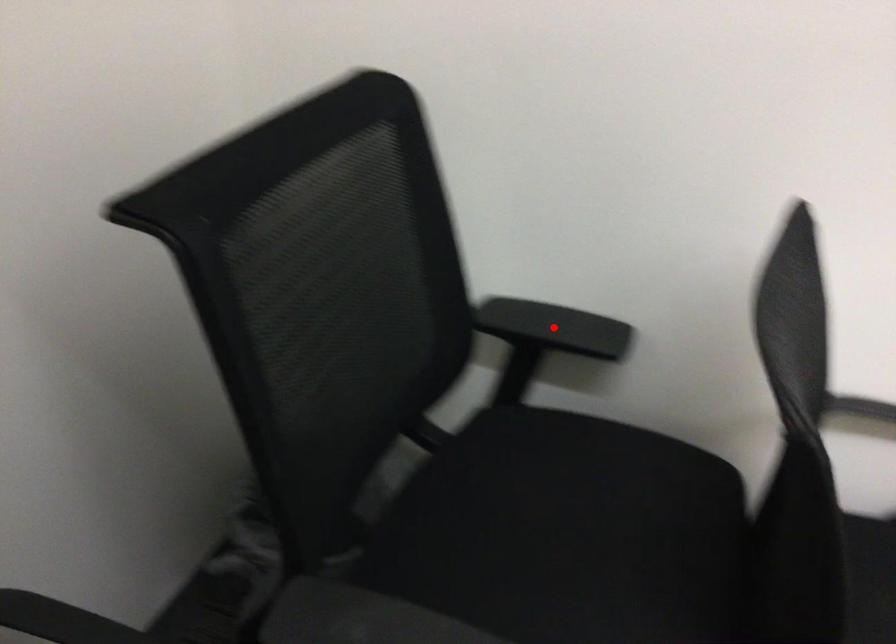
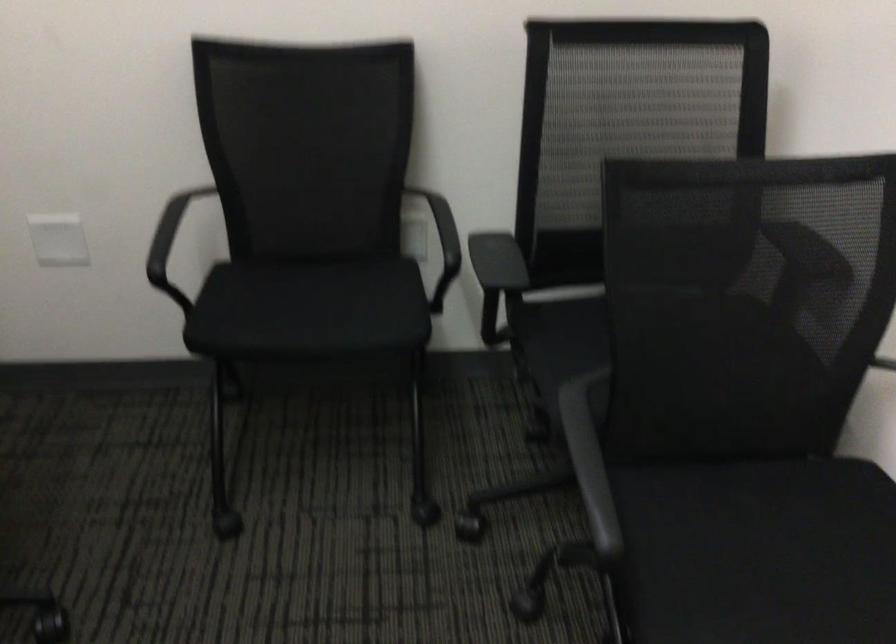
Question: I am providing you with two images of the same scene from different viewpoints. A red point is marked on the first image. Is the red point's position out of view in image 2?

Choices:
 (A) Yes
 (B) No

Answer: (A)